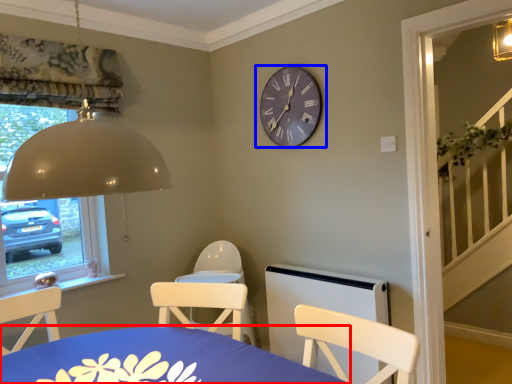
Question: Which object appears farthest to the camera in this image, table (highlighted by a red box) or wall clock (highlighted by a blue box)?

Choices:
 (A) table
 (B) wall clock

Answer: (B)